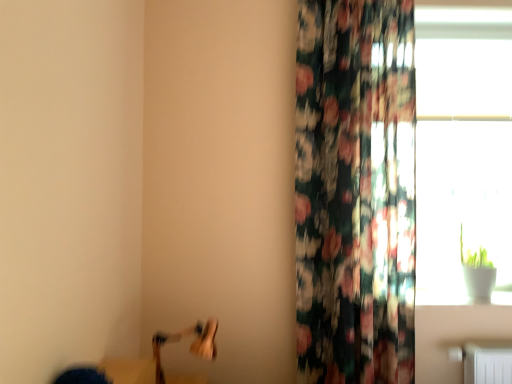
Question: Considering the relative positions of floral fabric curtain at right and wooden swivel chair at lower left in the image provided, is floral fabric curtain at right to the left or to the right of wooden swivel chair at lower left?

Choices:
 (A) left
 (B) right

Answer: (B)

Question: From the image's perspective, is floral fabric curtain at right above or below wooden swivel chair at lower left?

Choices:
 (A) below
 (B) above

Answer: (B)

Question: Which object is positioned closest to the wooden swivel chair at lower left?

Choices:
 (A) transparent glass window at upper right
 (B) floral fabric curtain at right

Answer: (B)

Question: Based on their relative distances, which object is nearer to the wooden swivel chair at lower left?

Choices:
 (A) transparent glass window at upper right
 (B) floral fabric curtain at right

Answer: (B)